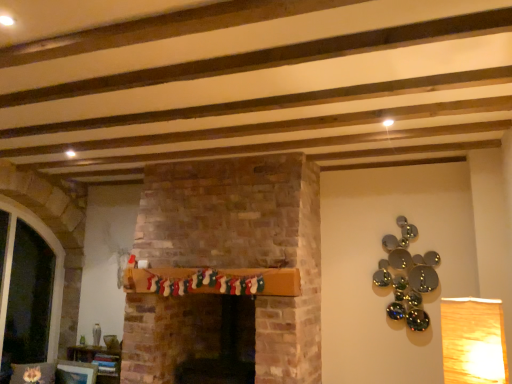
The image size is (512, 384). What do you see at coordinates (99, 361) in the screenshot? I see `wooden bookshelf at lower left` at bounding box center [99, 361].

In order to face wooden bookshelf at lower left, should I rotate leftwards or rightwards?

You should rotate left by 20.277 degrees.

Locate an element on the screen. This screenshot has height=384, width=512. velvet cushion at lower left is located at coordinates (54, 373).

Describe the element at coordinates (75, 372) in the screenshot. This screenshot has width=512, height=384. I see `matte white picture frame at lower left` at that location.

This screenshot has height=384, width=512. I want to click on transparent glass door at left, so click(x=28, y=288).

From the image's perspective, relative to wooden bookshelf at lower left, is matte white picture frame at lower left above or below?

Based on their image positions, matte white picture frame at lower left is located beneath wooden bookshelf at lower left.

Is matte white picture frame at lower left outside of wooden bookshelf at lower left?

Yes, matte white picture frame at lower left is outside of wooden bookshelf at lower left.

Which object is positioned more to the right, matte white picture frame at lower left or wooden bookshelf at lower left?

From the viewer's perspective, wooden bookshelf at lower left appears more on the right side.

How different are the orientations of matte white picture frame at lower left and wooden bookshelf at lower left in degrees?

They differ by 0.00395 degrees in their facing directions.

Where is `picture frame behind the velvet cushion at lower left`? This screenshot has height=384, width=512. picture frame behind the velvet cushion at lower left is located at coordinates (75, 372).

Looking at this image, which object is positioned more to the right, velvet cushion at lower left or matte white picture frame at lower left?

Positioned to the right is matte white picture frame at lower left.

Looking at their sizes, would you say velvet cushion at lower left is wider or thinner than matte white picture frame at lower left?

Considering their sizes, velvet cushion at lower left looks broader than matte white picture frame at lower left.

Is velvet cushion at lower left located outside matte white picture frame at lower left?

Yes, velvet cushion at lower left is outside of matte white picture frame at lower left.

From the image's perspective, does wooden mantel at center appear lower than velvet cushion at lower left?

No.

In the image, is wooden mantel at center positioned in front of or behind velvet cushion at lower left?

wooden mantel at center is positioned closer to the viewer than velvet cushion at lower left.

Locate an element on the screen. chair on the left of wooden mantel at center is located at coordinates (54, 373).

Is point (84, 372) positioned after point (77, 350)?

No, it is not.

From a real-world perspective, which is physically below, velvet cushion at lower left or wooden bookshelf at lower left?

From a 3D spatial view, wooden bookshelf at lower left is below.

Can you confirm if velvet cushion at lower left is positioned to the right of wooden bookshelf at lower left?

No.

Can you tell me how much velvet cushion at lower left and wooden bookshelf at lower left differ in facing direction?

The facing directions of velvet cushion at lower left and wooden bookshelf at lower left are 47.7 degrees apart.

Does point (71, 359) come closer to viewer compared to point (26, 366)?

No.

From the image's perspective, is wooden bookshelf at lower left above or below velvet cushion at lower left?

wooden bookshelf at lower left is situated lower than velvet cushion at lower left in the image.

From a real-world perspective, between wooden bookshelf at lower left and velvet cushion at lower left, who is vertically lower?

wooden bookshelf at lower left is physically lower.

Considering the sizes of objects wooden bookshelf at lower left and velvet cushion at lower left in the image provided, who is smaller, wooden bookshelf at lower left or velvet cushion at lower left?

Smaller between the two is velvet cushion at lower left.

From the image's perspective, between velvet cushion at lower left and transparent glass door at left, who is located below?

velvet cushion at lower left, from the image's perspective.

Can you confirm if velvet cushion at lower left is taller than transparent glass door at left?

Incorrect, the height of velvet cushion at lower left is not larger of that of transparent glass door at left.

From a real-world perspective, which is physically below, velvet cushion at lower left or transparent glass door at left?

velvet cushion at lower left, from a real-world perspective.

Choose the correct answer: Is velvet cushion at lower left inside transparent glass door at left or outside it?

velvet cushion at lower left exists outside the volume of transparent glass door at left.

From a real-world perspective, between transparent glass door at left and velvet cushion at lower left, who is vertically lower?

From a 3D spatial view, velvet cushion at lower left is below.

Is transparent glass door at left inside the boundaries of velvet cushion at lower left, or outside?

transparent glass door at left is not enclosed by velvet cushion at lower left.

Identify the location of glass door that is behind the velvet cushion at lower left. (28, 288).

Which is nearer, (11,239) or (72,367)?

Point (11,239)

You are a GUI agent. You are given a task and a screenshot of the screen. Output one action in this format:
    pyautogui.click(x=<x>, y=<y>)
    Task: Click on the furniture on the right of matte white picture frame at lower left
    The image size is (512, 384).
    Given the screenshot: What is the action you would take?
    pyautogui.click(x=99, y=361)

At what (x,y) coordinates should I click in order to perform the action: click on chair lying above the matte white picture frame at lower left (from the image's perspective). Please return your answer as a coordinate pair (x, y). The height and width of the screenshot is (384, 512). Looking at the image, I should click on [54, 373].

Considering their positions, is transparent glass door at left positioned closer to matte white picture frame at lower left than wooden bookshelf at lower left?

Among the two, wooden bookshelf at lower left is located nearer to matte white picture frame at lower left.

Looking at this image, based on their spatial positions, is wooden mantel at center or wooden bookshelf at lower left closer to matte white picture frame at lower left?

Based on the image, wooden bookshelf at lower left appears to be nearer to matte white picture frame at lower left.

When comparing their distances from wooden mantel at center, does velvet cushion at lower left or matte white picture frame at lower left seem closer?

velvet cushion at lower left is positioned closer to the anchor wooden mantel at center.

Estimate the real-world distances between objects in this image. Which object is further from velvet cushion at lower left, wooden bookshelf at lower left or wooden mantel at center?

Based on the image, wooden mantel at center appears to be further to velvet cushion at lower left.

Considering their positions, is velvet cushion at lower left positioned further to matte white picture frame at lower left than transparent glass door at left?

transparent glass door at left.

Considering their positions, is wooden bookshelf at lower left positioned closer to transparent glass door at left than matte white picture frame at lower left?

The object closer to transparent glass door at left is wooden bookshelf at lower left.

Which object lies nearer to the anchor point transparent glass door at left, wooden mantel at center or velvet cushion at lower left?

Among the two, velvet cushion at lower left is located nearer to transparent glass door at left.

Based on their spatial positions, is velvet cushion at lower left or wooden bookshelf at lower left closer to wooden mantel at center?

Result: Among the two, wooden bookshelf at lower left is located nearer to wooden mantel at center.

This screenshot has width=512, height=384. I want to click on chair between transparent glass door at left and wooden mantel at center from left to right, so point(54,373).

The width and height of the screenshot is (512, 384). Find the location of `furniture between velvet cushion at lower left and wooden mantel at center in the horizontal direction`. furniture between velvet cushion at lower left and wooden mantel at center in the horizontal direction is located at coordinates (99, 361).

You are a GUI agent. You are given a task and a screenshot of the screen. Output one action in this format:
    pyautogui.click(x=<x>, y=<y>)
    Task: Click on the furniture situated between matte white picture frame at lower left and wooden mantel at center from left to right
    
    Given the screenshot: What is the action you would take?
    pyautogui.click(x=99, y=361)

Locate an element on the screen. This screenshot has height=384, width=512. picture frame between transparent glass door at left and wooden mantel at center from left to right is located at coordinates pos(75,372).